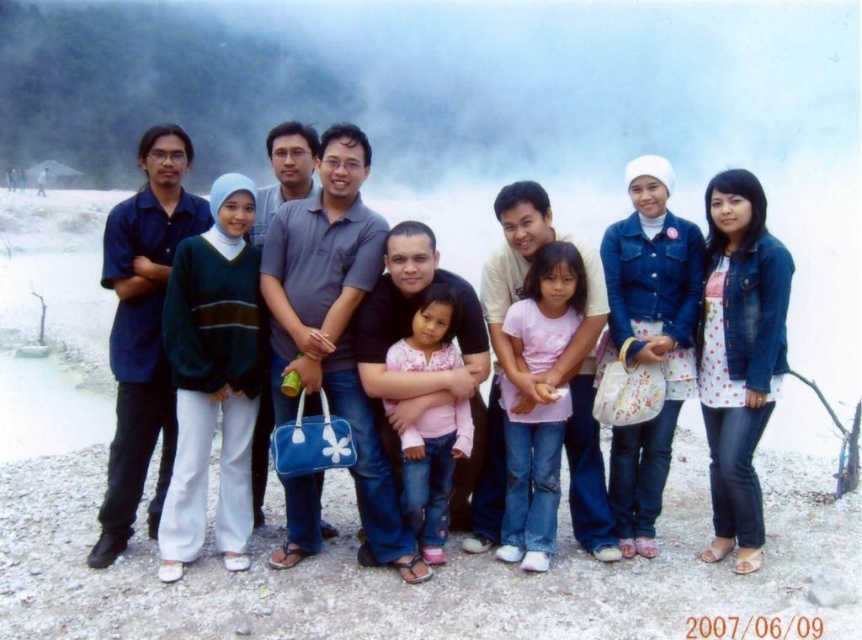
You are a photographer taking a group photo of the group in the scene. You want to ensure that both the pink matte shirt at center and the pink fabric shirt at center are clearly visible in the photo. Given that your camera has a depth of field that can sharply focus on objects within a 5 feet range, will both shirts be in focus?

The pink matte shirt at center is 6.44 feet away from the pink fabric shirt at center. Since the distance between them exceeds the 5 feet depth of field range, only one of the shirts will be in focus, not both.

Looking at this image, you are a photographer trying to adjust the positions of the matte black shirt at center and pink fabric shirt at center so that they are closer to each other for a better composition. Given that the minimum safe distance required between people in this area is 2 meters to avoid the hot ground, can you move them closer than their current 3.18 meters apart?

The current distance between the matte black shirt at center and pink fabric shirt at center is 3.18 meters. Since the minimum safe distance is 2 meters, you can move them closer to at least 2 meters apart while still maintaining safety.

You are a photographer trying to adjust the lighting for the group photo. You notice two people in the front row wearing a matte black shirt at center and a pink matte shirt at center. Which one is positioned to the left of the other?

The matte black shirt at center is to the left of the pink matte shirt at center.